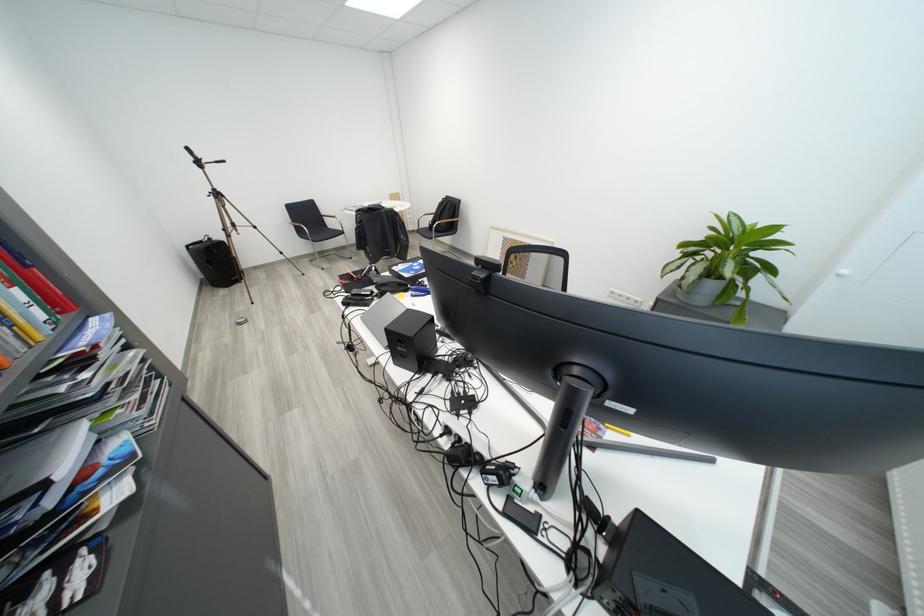
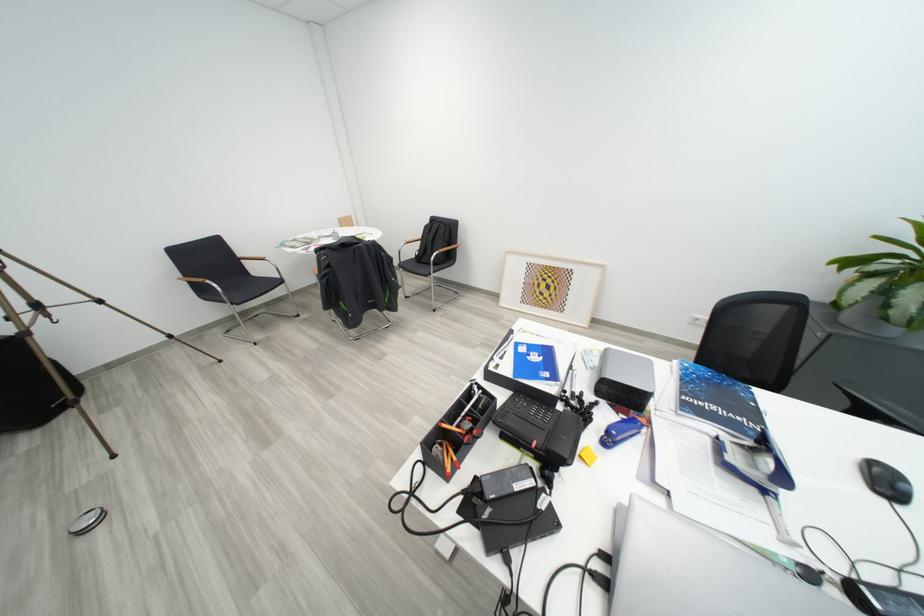
Locate, in the second image, the point that corresponds to pixel 302 224 in the first image.

(195, 277)